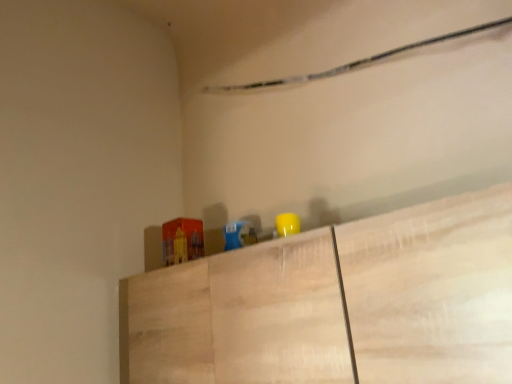
The height and width of the screenshot is (384, 512). What do you see at coordinates (336, 304) in the screenshot?
I see `light wood cabinet at upper center` at bounding box center [336, 304].

Image resolution: width=512 pixels, height=384 pixels. In order to click on light wood cabinet at upper center in this screenshot , I will do `click(336, 304)`.

Where is `light wood cabinet at upper center`? light wood cabinet at upper center is located at coordinates (336, 304).